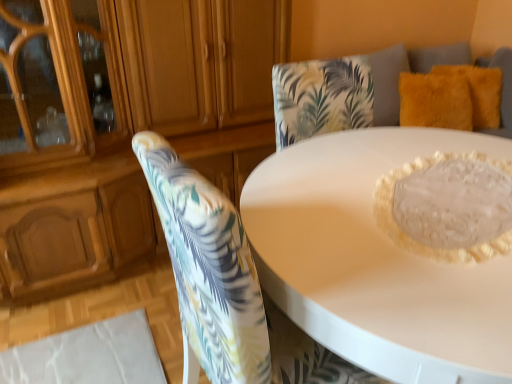
Question: Is matte wood dresser at upper left smaller than white glossy table at center?

Choices:
 (A) no
 (B) yes

Answer: (A)

Question: From the image's perspective, is matte wood dresser at upper left below white glossy table at center?

Choices:
 (A) yes
 (B) no

Answer: (B)

Question: Considering the relative sizes of matte wood dresser at upper left and white glossy table at center in the image provided, is matte wood dresser at upper left thinner than white glossy table at center?

Choices:
 (A) yes
 (B) no

Answer: (A)

Question: Can you confirm if matte wood dresser at upper left is positioned to the right of white glossy table at center?

Choices:
 (A) yes
 (B) no

Answer: (B)

Question: From a real-world perspective, is matte wood dresser at upper left on top of white glossy table at center?

Choices:
 (A) no
 (B) yes

Answer: (B)

Question: Is matte wood dresser at upper left at the left side of white glossy table at center?

Choices:
 (A) yes
 (B) no

Answer: (A)

Question: Are fuzzy yellow pillow at upper right, which is the second pillow from left to right, and fuzzy yellow pillow at upper right, which is the 1th pillow from left to right, making contact?

Choices:
 (A) no
 (B) yes

Answer: (A)

Question: Can you confirm if fuzzy yellow pillow at upper right, positioned as the first pillow in right-to-left order, is taller than fuzzy yellow pillow at upper right, which is the 1th pillow from left to right?

Choices:
 (A) no
 (B) yes

Answer: (A)

Question: Is fuzzy yellow pillow at upper right, positioned as the first pillow in right-to-left order, to the left of fuzzy yellow pillow at upper right, which is the 1th pillow from left to right, from the viewer's perspective?

Choices:
 (A) yes
 (B) no

Answer: (B)

Question: Can we say fuzzy yellow pillow at upper right, which is the second pillow from left to right, lies outside fuzzy yellow pillow at upper right, which is the 1th pillow from left to right?

Choices:
 (A) yes
 (B) no

Answer: (A)

Question: From a real-world perspective, is fuzzy yellow pillow at upper right, which is the second pillow from left to right, over fuzzy yellow pillow at upper right, which is the 1th pillow from left to right?

Choices:
 (A) yes
 (B) no

Answer: (A)

Question: Considering the relative sizes of fuzzy yellow pillow at upper right, positioned as the first pillow in right-to-left order, and fuzzy yellow pillow at upper right, the 2th pillow positioned from the right, in the image provided, is fuzzy yellow pillow at upper right, positioned as the first pillow in right-to-left order, wider than fuzzy yellow pillow at upper right, the 2th pillow positioned from the right,?

Choices:
 (A) yes
 (B) no

Answer: (A)

Question: From the image's perspective, is fuzzy yellow pillow at upper right, positioned as the first pillow in right-to-left order, under white glossy table at center?

Choices:
 (A) yes
 (B) no

Answer: (B)